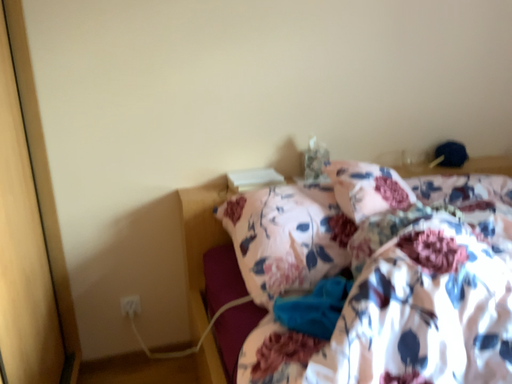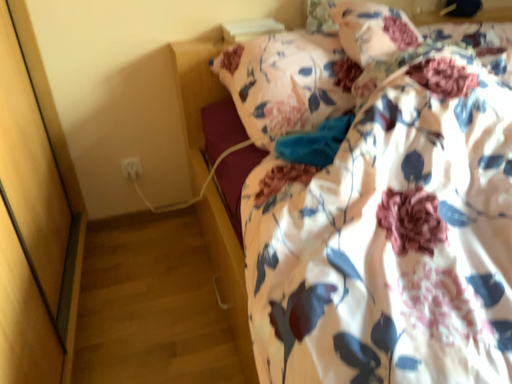
Question: Which way did the camera rotate in the video?

Choices:
 (A) rotated upward
 (B) rotated downward

Answer: (B)